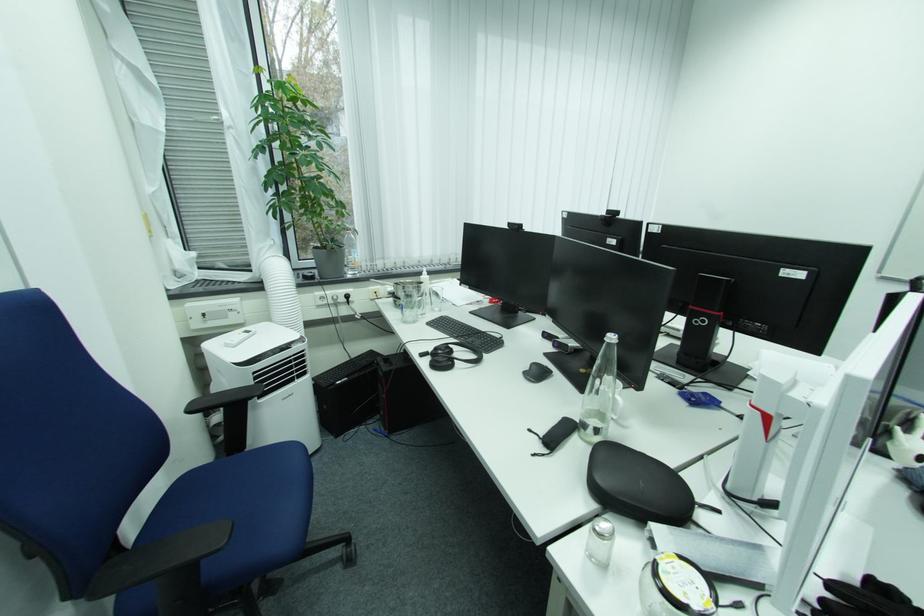
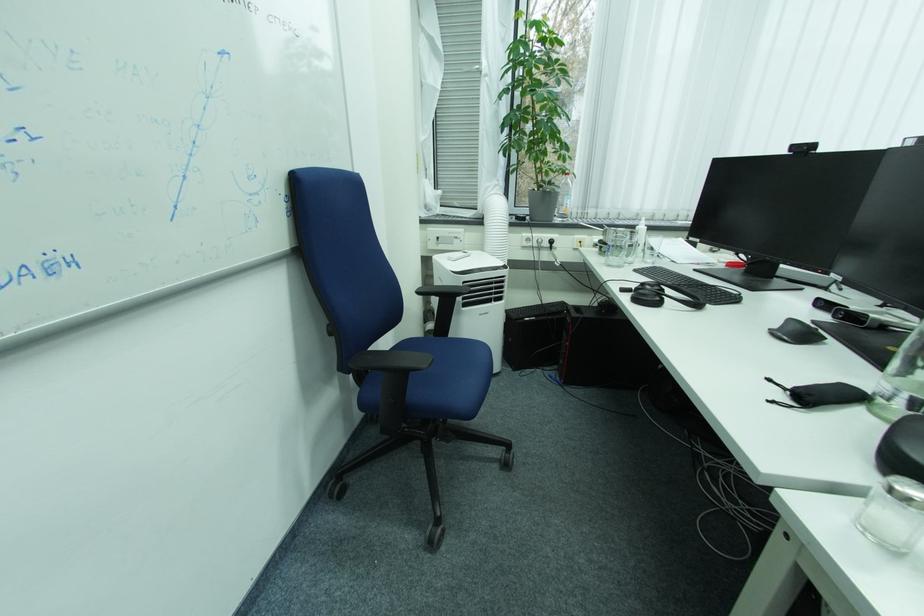
Where in the second image is the point corresponding to point (320, 278) from the first image?

(530, 220)